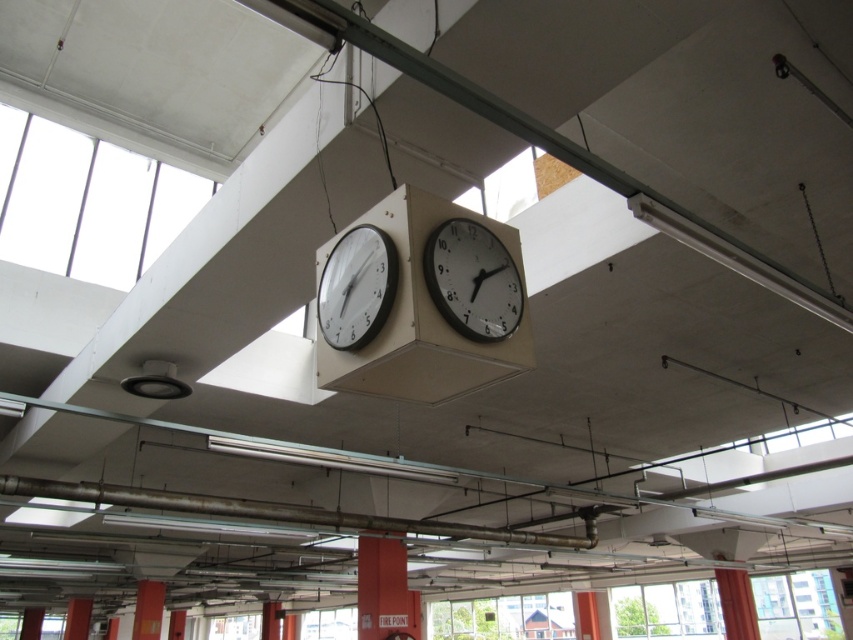
You are standing in the parking garage and need to locate both the white glossy clock at upper center and the white plastic clock at center. According to the scene, which clock is positioned to the right of the other?

The white glossy clock at upper center is to the right of the white plastic clock at center.

You are an interior designer planning to install a new rectangular ceiling panel that must fit between the white glossy clock at upper center and the white plastic clock at center. Based on their widths, can you determine if the panel will fit without overlapping either clock?

The white glossy clock at upper center might be wider than the white plastic clock at center, so the panel may not fit properly between them without overlapping the wider clock.

You are a maintenance worker standing in the parking garage and need to reach the point at coordinates point (457,332) to inspect a light fixture. If your ladder can extend up to 2.5 meters, will it be sufficient to reach that point?

The point at coordinates point (457,332) is 2.42 meters away from the viewer. Since the ladder can extend up to 2.5 meters, it will be sufficient to reach that point.